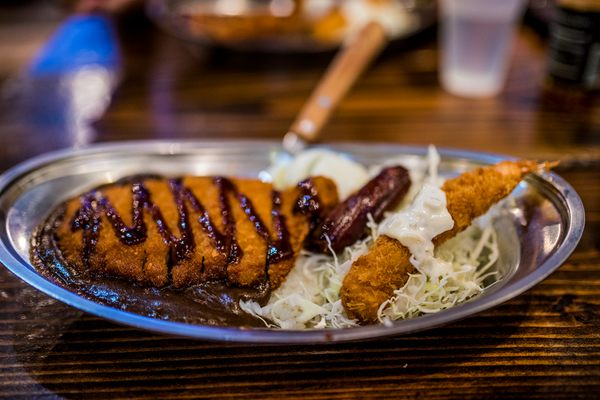
Where is `plate`? The height and width of the screenshot is (400, 600). plate is located at coordinates (494, 294).